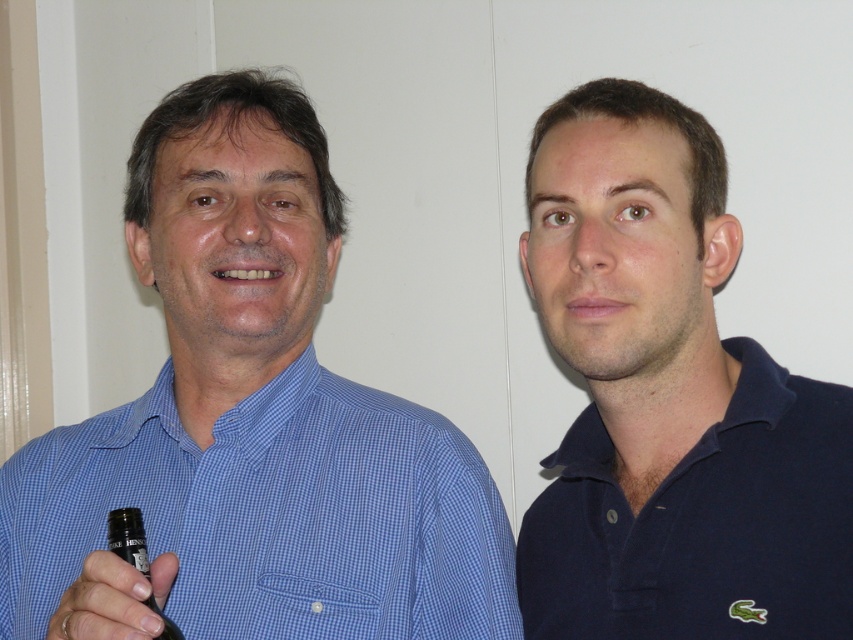
Between blue checkered shirt at left and dark glass bottle at lower left, which one has less height?

dark glass bottle at lower left is shorter.

Does blue checkered shirt at left have a greater height compared to dark glass bottle at lower left?

Correct, blue checkered shirt at left is much taller as dark glass bottle at lower left.

Between point (200, 228) and point (131, 550), which one is positioned behind?

Point (200, 228)

The image size is (853, 640). What are the coordinates of `blue checkered shirt at left` in the screenshot? It's located at (257, 417).

Does blue checkered shirt at left appear on the left side of navy blue polo shirt at right?

Yes, blue checkered shirt at left is to the left of navy blue polo shirt at right.

Which is behind, point (297, 204) or point (734, 243)?

Point (297, 204)

This screenshot has width=853, height=640. What do you see at coordinates (257, 417) in the screenshot?
I see `blue checkered shirt at left` at bounding box center [257, 417].

Find the location of a particular element. This screenshot has width=853, height=640. blue checkered shirt at left is located at coordinates (257, 417).

Does navy blue polo shirt at right have a larger size compared to dark glass bottle at lower left?

Indeed, navy blue polo shirt at right has a larger size compared to dark glass bottle at lower left.

Is point (628, 115) positioned behind point (129, 531)?

Yes.

Find the location of a particular element. navy blue polo shirt at right is located at coordinates (669, 401).